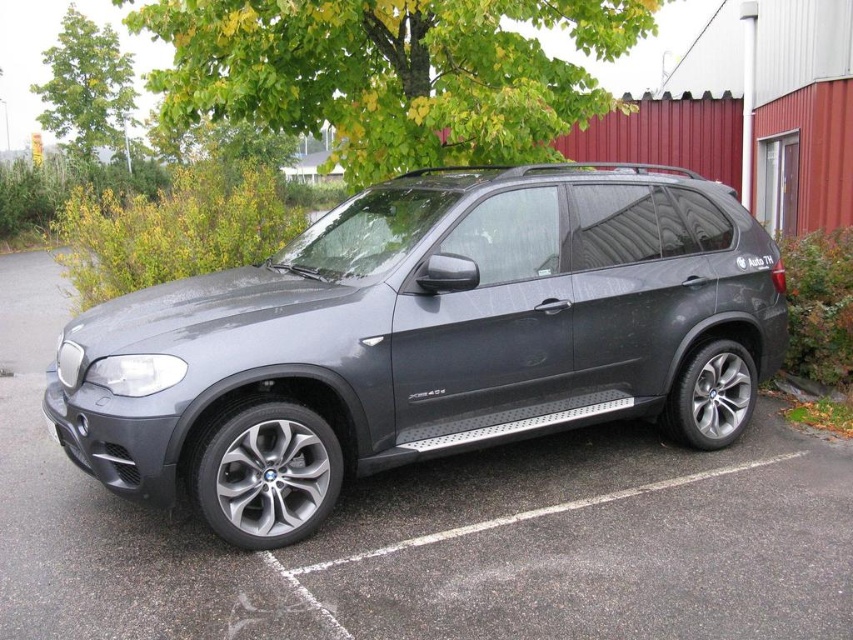
Question: Which point is closer to the camera?

Choices:
 (A) satin metallic suv at center
 (B) green leafy tree at upper left

Answer: (A)

Question: Does satin metallic suv at center appear on the right side of green leafy tree at upper center?

Choices:
 (A) yes
 (B) no

Answer: (A)

Question: Is satin metallic suv at center thinner than green leafy tree at upper left?

Choices:
 (A) yes
 (B) no

Answer: (B)

Question: Does satin metallic suv at center have a larger size compared to green leafy tree at upper center?

Choices:
 (A) no
 (B) yes

Answer: (B)

Question: Which object is closer to the camera taking this photo?

Choices:
 (A) green leafy tree at upper left
 (B) satin metallic suv at center
 (C) green leafy tree at upper center

Answer: (B)

Question: Which of the following is the farthest from the observer?

Choices:
 (A) green leafy tree at upper left
 (B) satin metallic suv at center
 (C) green leafy tree at upper center

Answer: (A)